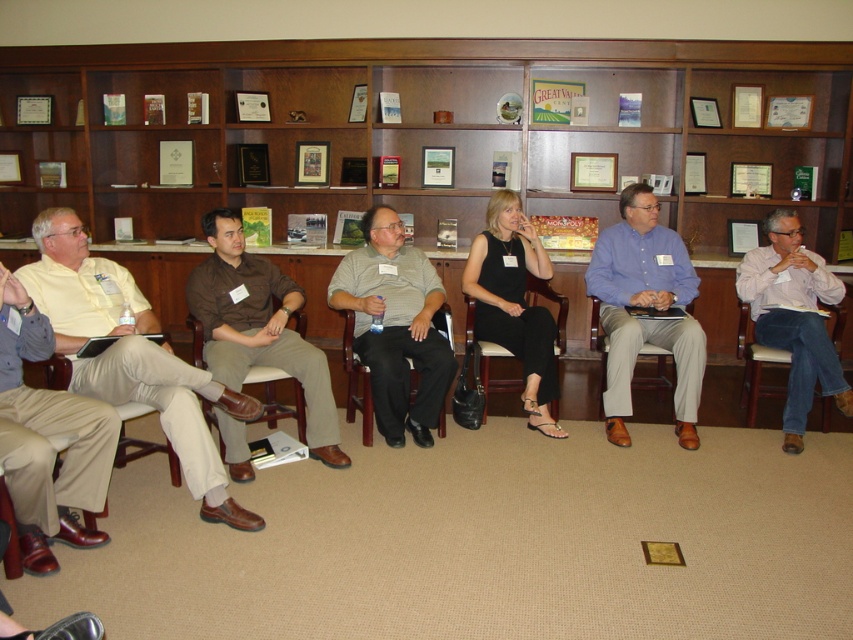
Can you confirm if blue cotton shirt at center is thinner than brown leather chair at center?

Correct, blue cotton shirt at center's width is less than brown leather chair at center's.

Is the position of blue cotton shirt at center more distant than that of brown leather chair at center?

No, it is in front of brown leather chair at center.

Is point (627, 342) less distant than point (830, 342)?

Yes, it is.

The width and height of the screenshot is (853, 640). What are the coordinates of `blue cotton shirt at center` in the screenshot? It's located at (645, 307).

Is tan fabric chair at center thinner than brown leather chair at center?

Indeed, tan fabric chair at center has a lesser width compared to brown leather chair at center.

Which is behind, point (698, 390) or point (755, 346)?

Positioned behind is point (755, 346).

Where is `tan fabric chair at center`? The height and width of the screenshot is (640, 853). tan fabric chair at center is located at coordinates tap(639, 353).

Consider the image. Does tan fabric chair at center appear over brown leather armchair at center?

Indeed, tan fabric chair at center is positioned over brown leather armchair at center.

Who is more forward, (x=699, y=390) or (x=270, y=410)?

Point (x=270, y=410) is in front.

Locate an element on the screen. tan fabric chair at center is located at coordinates (639, 353).

The height and width of the screenshot is (640, 853). Identify the location of tan fabric chair at center. (639, 353).